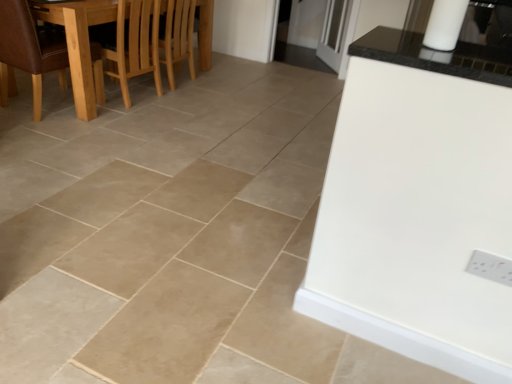
Identify the location of unoccupied area in front of brown leather chair at left. (61, 134).